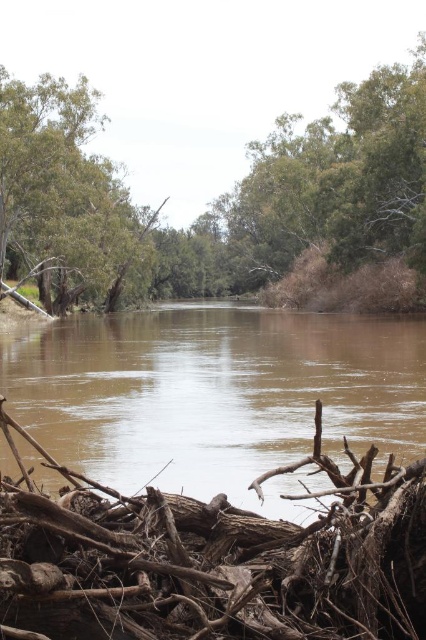
Is point (123, 419) closer to viewer compared to point (287, 182)?

Yes.

From the picture: Who is more forward, (268,372) or (423,100)?

Point (268,372) is more forward.

Locate an element on the screen. The width and height of the screenshot is (426, 640). brown muddy water at center is located at coordinates (218, 396).

Is point (411, 83) in front of point (68, 156)?

No, (411, 83) is behind (68, 156).

Can you confirm if green leafy tree at center is taller than green leafy tree at upper left?

Yes.

Locate an element on the screen. This screenshot has height=640, width=426. green leafy tree at center is located at coordinates (216, 198).

What do you see at coordinates (213, 557) in the screenshot? I see `brown rough wood at lower center` at bounding box center [213, 557].

Is point (261, 545) less distant than point (60, 189)?

That is True.

You are a GUI agent. You are given a task and a screenshot of the screen. Output one action in this format:
    pyautogui.click(x=<x>, y=<y>)
    Task: Click on the brown rough wood at lower center
    This screenshot has width=426, height=640.
    Given the screenshot: What is the action you would take?
    pyautogui.click(x=213, y=557)